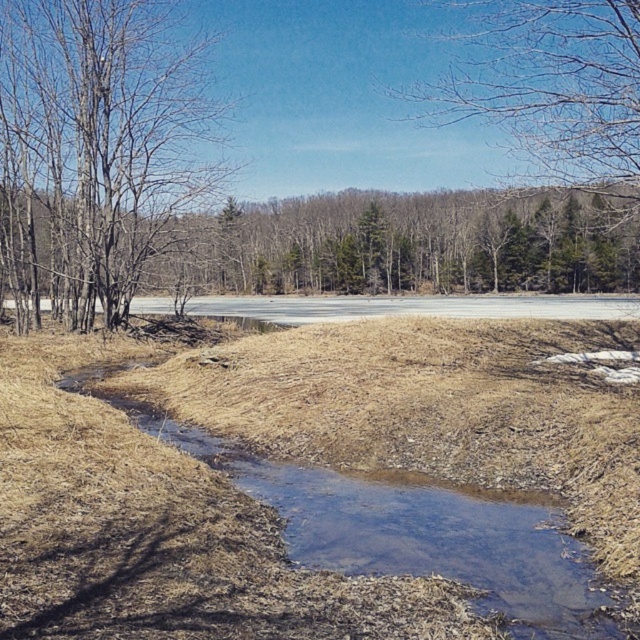
Question: Among these points, which one is farthest from the camera?

Choices:
 (A) (188, 116)
 (B) (593, 605)
 (C) (481, 3)

Answer: (C)

Question: Which of the following is the farthest from the observer?

Choices:
 (A) clear water at center
 (B) bare branches at left
 (C) brown leafless tree at upper center

Answer: (B)

Question: Observing the image, what is the correct spatial positioning of bare branches at left in reference to brown leafless tree at upper center?

Choices:
 (A) left
 (B) right

Answer: (A)

Question: Does bare branches at left appear over brown leafless tree at upper center?

Choices:
 (A) yes
 (B) no

Answer: (B)

Question: Which of the following is the closest to the observer?

Choices:
 (A) clear water at center
 (B) bare branches at left
 (C) brown leafless tree at upper center

Answer: (A)

Question: Is bare branches at left above clear water at center?

Choices:
 (A) no
 (B) yes

Answer: (B)